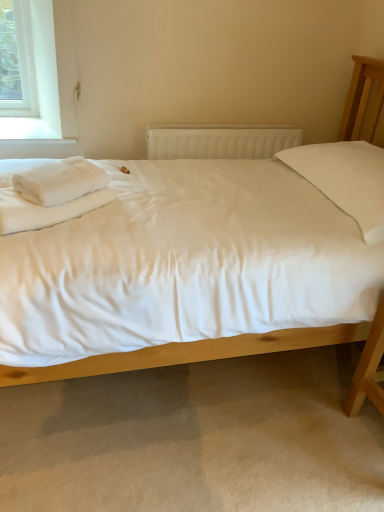
Question: From the image's perspective, is white fluffy towel at left above white plastic radiator at center?

Choices:
 (A) no
 (B) yes

Answer: (A)

Question: Is white fluffy towel at left far from white plastic radiator at center?

Choices:
 (A) no
 (B) yes

Answer: (A)

Question: Is white fluffy towel at left outside white plastic radiator at center?

Choices:
 (A) no
 (B) yes

Answer: (B)

Question: Can you confirm if white fluffy towel at left is positioned to the right of white plastic radiator at center?

Choices:
 (A) yes
 (B) no

Answer: (B)

Question: Is white fluffy towel at left shorter than white plastic radiator at center?

Choices:
 (A) no
 (B) yes

Answer: (B)

Question: Does white fluffy towel at left appear on the left side of white plastic radiator at center?

Choices:
 (A) yes
 (B) no

Answer: (A)

Question: Can we say white fluffy towel at left lies outside white soft bedsheet at left?

Choices:
 (A) no
 (B) yes

Answer: (A)

Question: Is white fluffy towel at left with white soft bedsheet at left?

Choices:
 (A) yes
 (B) no

Answer: (A)

Question: Does white fluffy towel at left appear on the right side of white soft bedsheet at left?

Choices:
 (A) yes
 (B) no

Answer: (A)

Question: Are white fluffy towel at left and white soft bedsheet at left far apart?

Choices:
 (A) no
 (B) yes

Answer: (A)

Question: From a real-world perspective, is white fluffy towel at left positioned under white soft bedsheet at left based on gravity?

Choices:
 (A) no
 (B) yes

Answer: (A)

Question: Is white soft bedsheet at left a part of white fluffy towel at left?

Choices:
 (A) yes
 (B) no

Answer: (B)

Question: Is white cotton bed at center smaller than white fluffy towel at left?

Choices:
 (A) no
 (B) yes

Answer: (A)